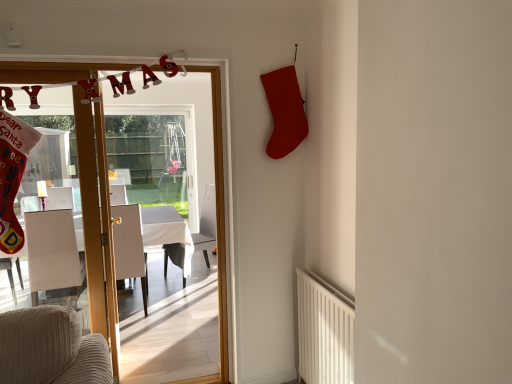
Question: Is white glossy door at center closer to the viewer compared to white fabric armchair at center, which appears as the 2th armchair when viewed from the right?

Choices:
 (A) no
 (B) yes

Answer: (B)

Question: From a real-world perspective, is white glossy door at center physically above white fabric armchair at center, which appears as the 2th armchair when viewed from the right?

Choices:
 (A) yes
 (B) no

Answer: (A)

Question: Is white glossy door at center positioned with its back to white fabric armchair at center, placed as the 2th armchair when sorted from left to right?

Choices:
 (A) no
 (B) yes

Answer: (B)

Question: Is white glossy door at center far away from white fabric armchair at center, placed as the 2th armchair when sorted from left to right?

Choices:
 (A) no
 (B) yes

Answer: (B)

Question: Does white glossy door at center come behind white fabric armchair at center, placed as the 2th armchair when sorted from left to right?

Choices:
 (A) no
 (B) yes

Answer: (A)

Question: From their relative heights in the image, would you say white fabric armchair at left, which ranks as the 1th armchair in left-to-right order, is taller or shorter than white glossy table at left?

Choices:
 (A) tall
 (B) short

Answer: (A)

Question: In the image, is white fabric armchair at left, which ranks as the 1th armchair in left-to-right order, on the left side or the right side of white glossy table at left?

Choices:
 (A) left
 (B) right

Answer: (A)

Question: Is point (74, 238) closer or farther from the camera than point (81, 233)?

Choices:
 (A) farther
 (B) closer

Answer: (A)

Question: In the image, is white fabric armchair at left, marked as the 3th armchair in a right-to-left arrangement, positioned in front of or behind white glossy table at left?

Choices:
 (A) behind
 (B) front

Answer: (B)

Question: Would you say white glossy table at left is to the left or to the right of white fabric armchair at left, which ranks as the 1th armchair in left-to-right order, in the picture?

Choices:
 (A) right
 (B) left

Answer: (A)

Question: In terms of width, does white glossy table at left look wider or thinner when compared to white fabric armchair at left, marked as the 3th armchair in a right-to-left arrangement?

Choices:
 (A) thin
 (B) wide

Answer: (B)

Question: Is point (161, 218) positioned closer to the camera than point (57, 256)?

Choices:
 (A) closer
 (B) farther

Answer: (B)

Question: Based on their sizes in the image, would you say white glossy table at left is bigger or smaller than white fabric armchair at left, which ranks as the 1th armchair in left-to-right order?

Choices:
 (A) small
 (B) big

Answer: (B)

Question: Is white fabric armchair at center, positioned as the third armchair in left-to-right order, taller or shorter than white textured radiator at lower right?

Choices:
 (A) short
 (B) tall

Answer: (B)

Question: From a real-world perspective, relative to white textured radiator at lower right, is white fabric armchair at center, the first armchair positioned from the right, vertically above or below?

Choices:
 (A) below
 (B) above

Answer: (B)